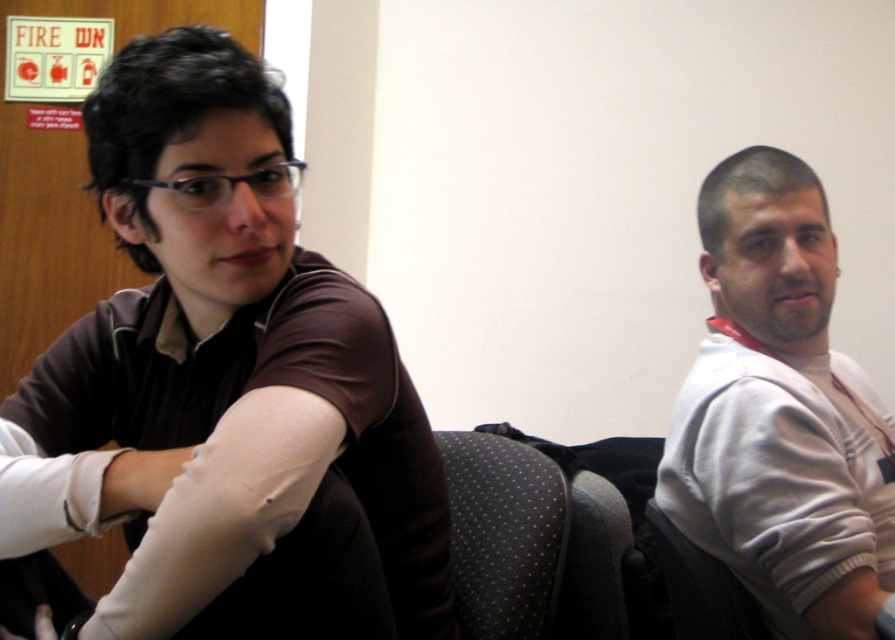
This screenshot has width=895, height=640. What do you see at coordinates (776, 403) in the screenshot?
I see `white fleece jacket at right` at bounding box center [776, 403].

Which of these two, white fleece jacket at right or white matte bandage at lower left, stands shorter?

Standing shorter between the two is white matte bandage at lower left.

Is point (814, 552) behind point (146, 490)?

Yes, point (814, 552) is behind point (146, 490).

The height and width of the screenshot is (640, 895). Find the location of `white fleece jacket at right`. white fleece jacket at right is located at coordinates (776, 403).

Between dark fabric armchair at center and white matte skin at lower right, which one appears on the right side from the viewer's perspective?

From the viewer's perspective, white matte skin at lower right appears more on the right side.

This screenshot has height=640, width=895. Describe the element at coordinates (503, 534) in the screenshot. I see `dark fabric armchair at center` at that location.

Locate an element on the screen. dark fabric armchair at center is located at coordinates (503, 534).

Describe the element at coordinates (139, 480) in the screenshot. This screenshot has height=640, width=895. I see `white matte bandage at lower left` at that location.

Locate an element on the screen. white matte bandage at lower left is located at coordinates (139, 480).